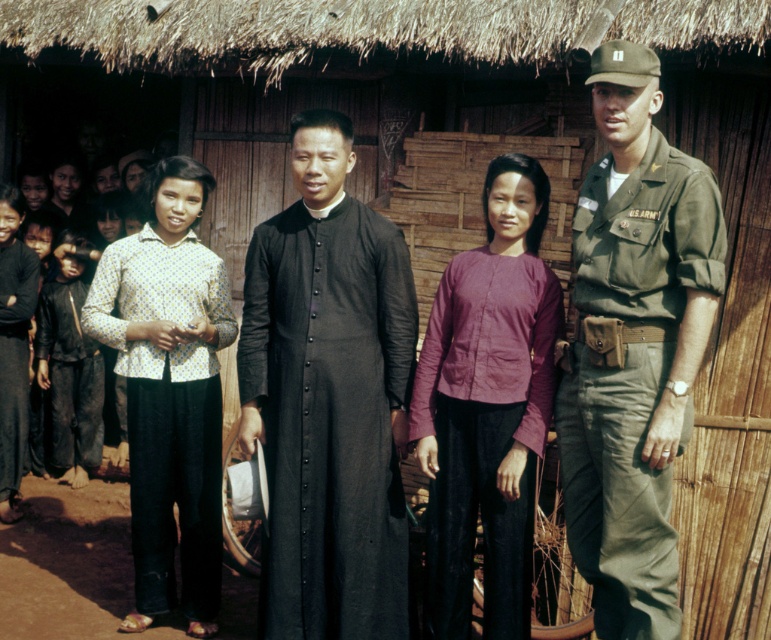
You are observing a scene where there are two people dressed in different colors. One is wearing an olive drab uniform at right and the other a yellow dotted shirt at left. From your perspective, which person is positioned higher in the image?

The olive drab uniform at right is located above the yellow dotted shirt at left, so the person in the olive drab uniform at right is positioned higher in the image.

You are standing at the camera position and want to take a photo of the black matte robe at center. Can you estimate how far you need to walk forward to get the robe to fill your camera frame properly?

The black matte robe at center is 15.98 feet away from the camera. To fill the frame, you would need to move closer, but the exact distance depends on your camera lens and desired framing. However, given the current distance is about 16 feet, moving to around 10 feet might be a starting point for a standard lens.